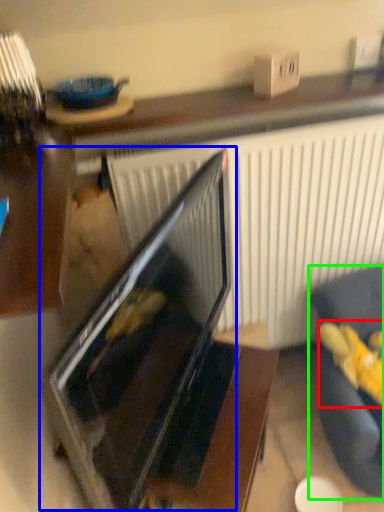
Question: Considering the real-world distances, which object is closest to stuff (highlighted by a red box)? oven (highlighted by a blue box) or furniture (highlighted by a green box).

Choices:
 (A) oven
 (B) furniture

Answer: (B)